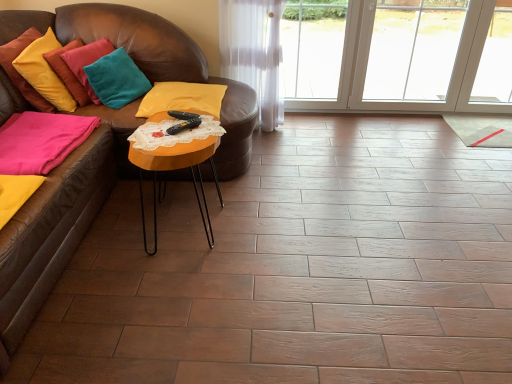
Question: Considering the relative sizes of velvet yellow pillow at upper left, the fourth pillow viewed from the right, and yellow velvet pillow at center, which is the 4th pillow in left-to-right order, in the image provided, is velvet yellow pillow at upper left, the fourth pillow viewed from the right, thinner than yellow velvet pillow at center, which is the 4th pillow in left-to-right order,?

Choices:
 (A) no
 (B) yes

Answer: (B)

Question: From a real-world perspective, is velvet yellow pillow at upper left, the fourth pillow viewed from the right, physically below yellow velvet pillow at center, which is the 4th pillow in left-to-right order?

Choices:
 (A) yes
 (B) no

Answer: (B)

Question: Is velvet yellow pillow at upper left, which is the 1th pillow from left to right, with yellow velvet pillow at center, positioned as the first pillow in right-to-left order?

Choices:
 (A) yes
 (B) no

Answer: (B)

Question: Is velvet yellow pillow at upper left, the fourth pillow viewed from the right, aimed at yellow velvet pillow at center, which is the 4th pillow in left-to-right order?

Choices:
 (A) no
 (B) yes

Answer: (B)

Question: Could yellow velvet pillow at center, positioned as the first pillow in right-to-left order, be considered to be inside velvet yellow pillow at upper left, the fourth pillow viewed from the right?

Choices:
 (A) yes
 (B) no

Answer: (B)

Question: Is orange wood table at center in front of or behind yellow velvet pillow at center, which is the 4th pillow in left-to-right order, in the image?

Choices:
 (A) front
 (B) behind

Answer: (A)

Question: From the image's perspective, is orange wood table at center positioned above or below yellow velvet pillow at center, which is the 4th pillow in left-to-right order?

Choices:
 (A) below
 (B) above

Answer: (A)

Question: From their relative heights in the image, would you say orange wood table at center is taller or shorter than yellow velvet pillow at center, positioned as the first pillow in right-to-left order?

Choices:
 (A) short
 (B) tall

Answer: (B)

Question: From a real-world perspective, is orange wood table at center above or below yellow velvet pillow at center, which is the 4th pillow in left-to-right order?

Choices:
 (A) above
 (B) below

Answer: (B)

Question: From a real-world perspective, is pink fabric pillow at lower left, which is the third pillow in right-to-left order, positioned above or below yellow velvet pillow at center, positioned as the first pillow in right-to-left order?

Choices:
 (A) below
 (B) above

Answer: (B)

Question: Is pink fabric pillow at lower left, which is the third pillow in right-to-left order, wider or thinner than yellow velvet pillow at center, which is the 4th pillow in left-to-right order?

Choices:
 (A) thin
 (B) wide

Answer: (A)

Question: In the image, is pink fabric pillow at lower left, the second pillow from the left, positioned in front of or behind yellow velvet pillow at center, positioned as the first pillow in right-to-left order?

Choices:
 (A) behind
 (B) front

Answer: (B)

Question: From the image's perspective, is pink fabric pillow at lower left, which is the third pillow in right-to-left order, above or below yellow velvet pillow at center, which is the 4th pillow in left-to-right order?

Choices:
 (A) above
 (B) below

Answer: (B)

Question: Is pink fabric pillow at lower left, the second pillow from the left, in front of or behind velvet yellow pillow at upper left, which is the 1th pillow from left to right, in the image?

Choices:
 (A) front
 (B) behind

Answer: (A)

Question: From the image's perspective, is pink fabric pillow at lower left, which is the third pillow in right-to-left order, above or below velvet yellow pillow at upper left, which is the 1th pillow from left to right?

Choices:
 (A) below
 (B) above

Answer: (A)